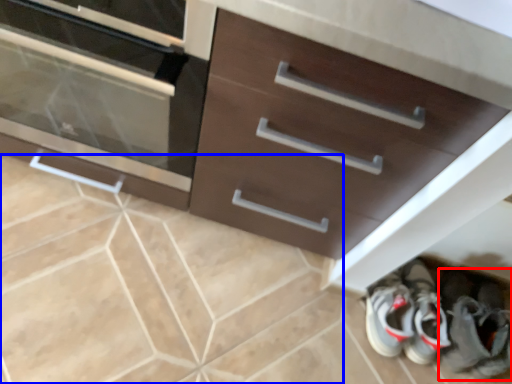
Question: Which point is further to the camera, footwear (highlighted by a red box) or ceramic tile (highlighted by a blue box)?

Choices:
 (A) footwear
 (B) ceramic tile

Answer: (A)